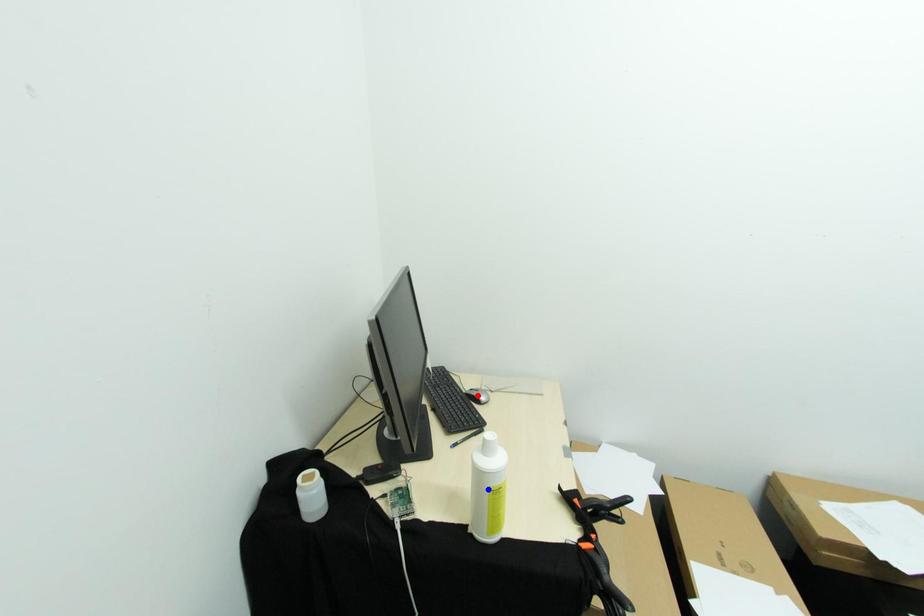
Question: Two points are marked on the image. Which point is closer to the camera?

Choices:
 (A) Blue point is closer.
 (B) Red point is closer.

Answer: (A)